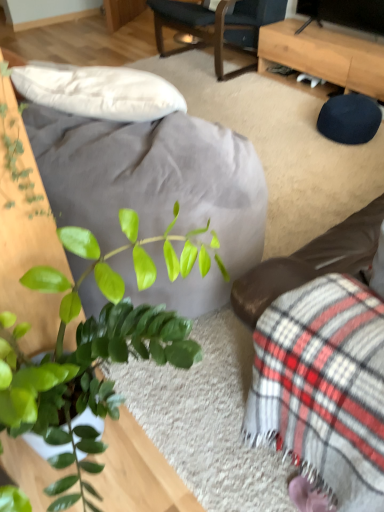
Question: Is light brown wooden desk at upper right at the left side of dark blue fabric chair at upper center?

Choices:
 (A) no
 (B) yes

Answer: (A)

Question: Is light brown wooden desk at upper right taller than dark blue fabric chair at upper center?

Choices:
 (A) yes
 (B) no

Answer: (B)

Question: From a real-world perspective, is light brown wooden desk at upper right on dark blue fabric chair at upper center?

Choices:
 (A) yes
 (B) no

Answer: (B)

Question: From the image's perspective, is light brown wooden desk at upper right above dark blue fabric chair at upper center?

Choices:
 (A) yes
 (B) no

Answer: (B)

Question: Is light brown wooden desk at upper right oriented away from dark blue fabric chair at upper center?

Choices:
 (A) yes
 (B) no

Answer: (B)

Question: From a real-world perspective, is light brown wooden desk at upper right positioned above or below dark blue fabric chair at upper center?

Choices:
 (A) below
 (B) above

Answer: (A)

Question: Visually, is light brown wooden desk at upper right positioned to the left or to the right of dark blue fabric chair at upper center?

Choices:
 (A) left
 (B) right

Answer: (B)

Question: Do you think light brown wooden desk at upper right is within dark blue fabric chair at upper center, or outside of it?

Choices:
 (A) outside
 (B) inside

Answer: (A)

Question: Is point (354, 41) closer or farther from the camera than point (251, 10)?

Choices:
 (A) farther
 (B) closer

Answer: (B)

Question: Is plaid fabric couch at lower right situated inside light brown wooden desk at upper right or outside?

Choices:
 (A) outside
 (B) inside

Answer: (A)

Question: Looking at the image, does plaid fabric couch at lower right seem bigger or smaller compared to light brown wooden desk at upper right?

Choices:
 (A) small
 (B) big

Answer: (A)

Question: Relative to light brown wooden desk at upper right, is plaid fabric couch at lower right in front or behind?

Choices:
 (A) behind
 (B) front

Answer: (B)

Question: Considering the positions of plaid fabric couch at lower right and light brown wooden desk at upper right in the image, is plaid fabric couch at lower right taller or shorter than light brown wooden desk at upper right?

Choices:
 (A) short
 (B) tall

Answer: (B)

Question: From the image's perspective, relative to dark blue fabric chair at upper center, is plaid fabric couch at lower right above or below?

Choices:
 (A) above
 (B) below

Answer: (B)

Question: Considering their positions, is plaid fabric couch at lower right located in front of or behind dark blue fabric chair at upper center?

Choices:
 (A) behind
 (B) front

Answer: (B)